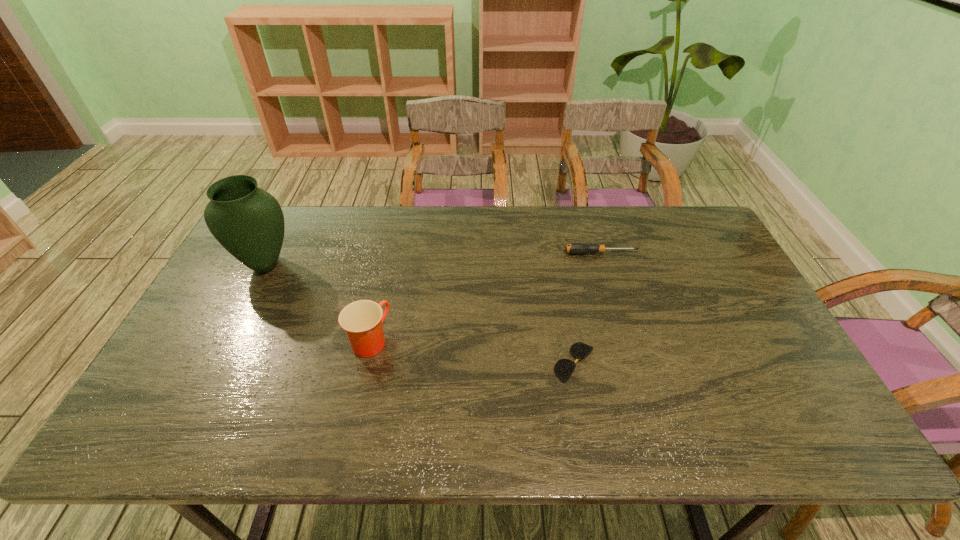
Image resolution: width=960 pixels, height=540 pixels. What are the coordinates of `unoccupied position between the second shortest object and the third shortest object` in the screenshot? It's located at (486, 297).

At what (x,y) coordinates should I click in order to perform the action: click on vacant space in between the cup and the leftmost object. Please return your answer as a coordinate pair (x, y). Looking at the image, I should click on (318, 302).

At what (x,y) coordinates should I click in order to perform the action: click on vacant space that is in between the shortest object and the cup. Please return your answer as a coordinate pair (x, y). The height and width of the screenshot is (540, 960). Looking at the image, I should click on (472, 352).

What are the coordinates of `free space between the second shortest object and the spectacles` in the screenshot? It's located at (588, 308).

Image resolution: width=960 pixels, height=540 pixels. What are the coordinates of `vacant area between the spectacles and the vase` in the screenshot? It's located at (420, 314).

Find the location of a particular element. free space between the second tallest object and the third tallest object is located at coordinates (486, 297).

Choose which object is the second nearest neighbor to the spectacles. Please provide its 2D coordinates. Your answer should be formatted as a tuple, i.e. [(x, y)], where the tuple contains the x and y coordinates of a point satisfying the conditions above.

[(362, 320)]

Locate an element on the screen. the closest object to the cup is located at coordinates (247, 221).

Where is `vacant area in the image that satisfies the following two spatial constraints: 1. on the back side of the cup; 2. on the right side of the second shortest object`? vacant area in the image that satisfies the following two spatial constraints: 1. on the back side of the cup; 2. on the right side of the second shortest object is located at coordinates (390, 253).

What are the coordinates of `vacant space that satisfies the following two spatial constraints: 1. on the front side of the second object from left to right; 2. on the right side of the spectacles` in the screenshot? It's located at (365, 363).